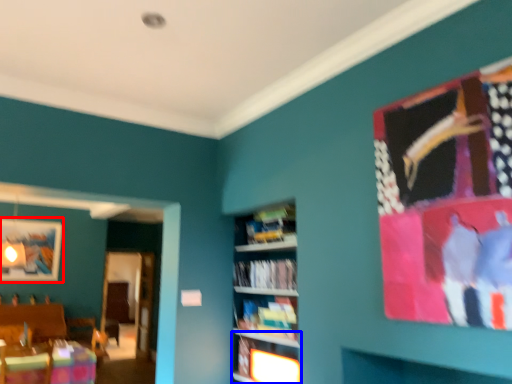
Question: Which point is closer to the camera, picture frame (highlighted by a red box) or shelf (highlighted by a blue box)?

Choices:
 (A) picture frame
 (B) shelf

Answer: (B)